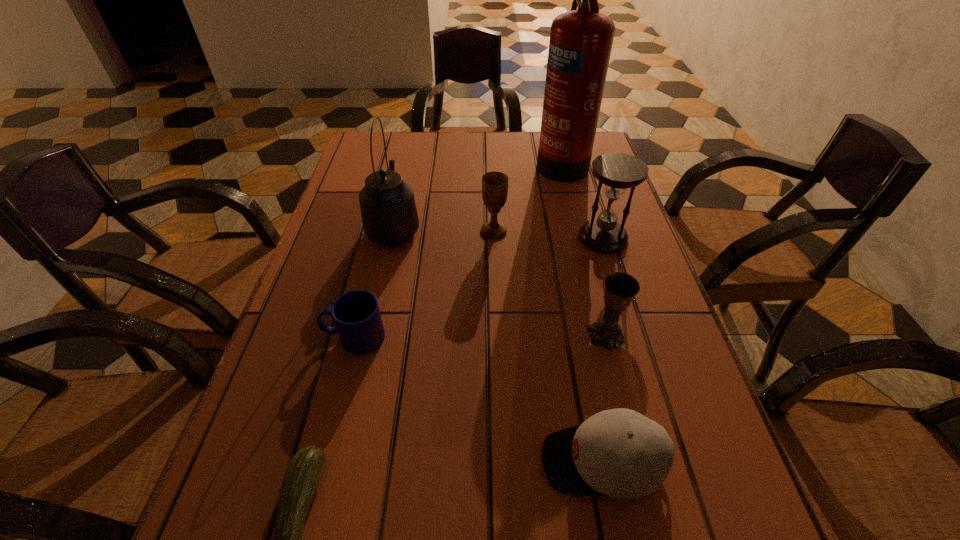
The image size is (960, 540). I want to click on vacant space located on the surface of the tallest object, so click(x=513, y=161).

I want to click on free point located 0.260m on the surface of the tallest object, so click(450, 161).

This screenshot has height=540, width=960. What are the coordinates of `free space located 0.150m spout on the kettle` in the screenshot? It's located at (405, 173).

The width and height of the screenshot is (960, 540). In order to click on vacant space situated spout on the kettle in this screenshot , I will do 405,173.

Image resolution: width=960 pixels, height=540 pixels. Identify the location of vacant region located 0.170m spout on the kettle. (406, 169).

Where is `blank area located 0.400m on the back of the hourglass`? The height and width of the screenshot is (540, 960). blank area located 0.400m on the back of the hourglass is located at coordinates (575, 145).

The image size is (960, 540). What are the coordinates of `vacant space situated 0.170m on the left of the left chalice` in the screenshot? It's located at (413, 231).

Find the location of a particular element. The width and height of the screenshot is (960, 540). vacant region located on the front of the right chalice is located at coordinates (615, 373).

You are a GUI agent. You are given a task and a screenshot of the screen. Output one action in this format:
    pyautogui.click(x=<x>, y=<y>)
    Task: Click on the vacant space located on the front-facing side of the baseball cap
    The height and width of the screenshot is (540, 960).
    Given the screenshot: What is the action you would take?
    pyautogui.click(x=478, y=461)

Where is `free space located on the front-facing side of the baseball cap`? This screenshot has width=960, height=540. free space located on the front-facing side of the baseball cap is located at coordinates (365, 461).